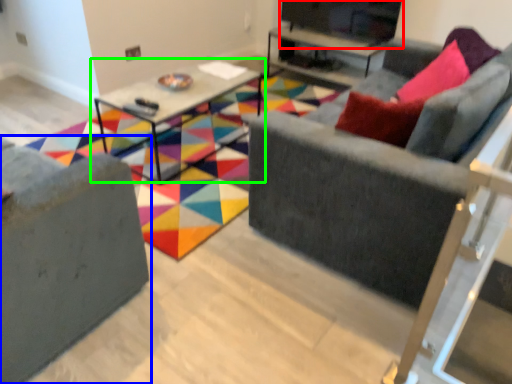
Question: Estimate the real-world distances between objects in this image. Which object is farther from entertainment center (highlighted by a red box), studio couch (highlighted by a blue box) or table (highlighted by a green box)?

Choices:
 (A) studio couch
 (B) table

Answer: (A)